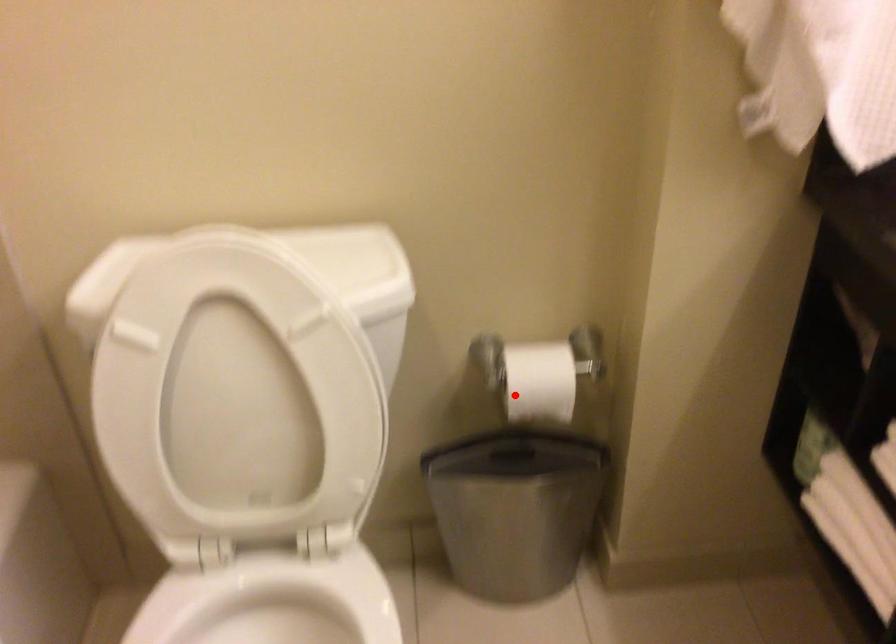
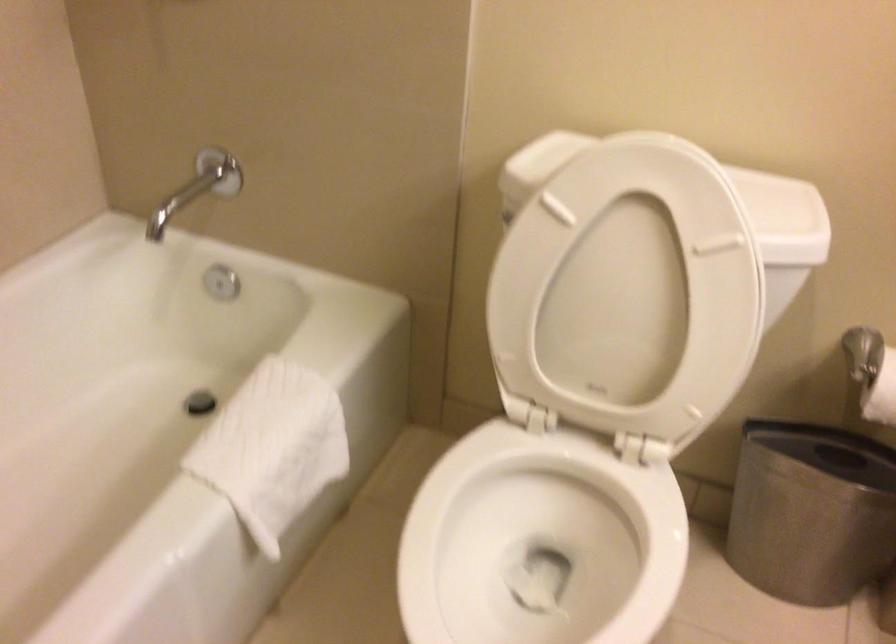
Where in the second image is the point corresponding to the highlighted location from the first image?

(881, 393)